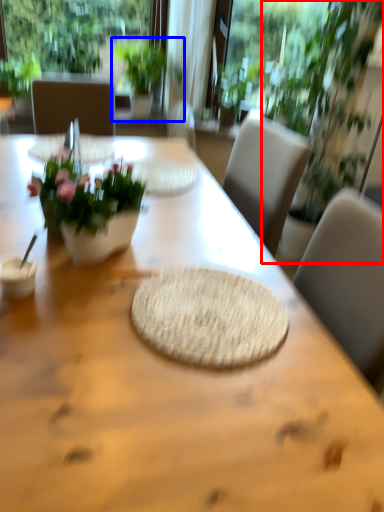
Question: Which object is closer to the camera taking this photo, houseplant (highlighted by a red box) or houseplant (highlighted by a blue box)?

Choices:
 (A) houseplant
 (B) houseplant

Answer: (A)